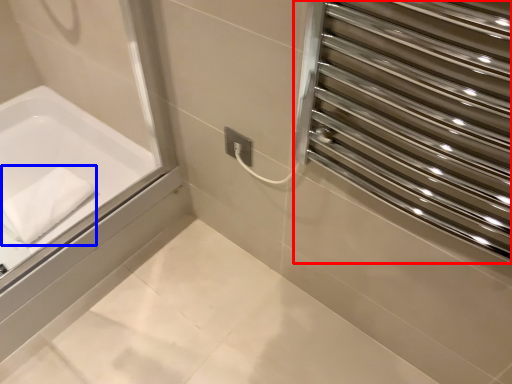
Question: Which point is further to the camera, screen door (highlighted by a red box) or bath towel (highlighted by a blue box)?

Choices:
 (A) screen door
 (B) bath towel

Answer: (B)